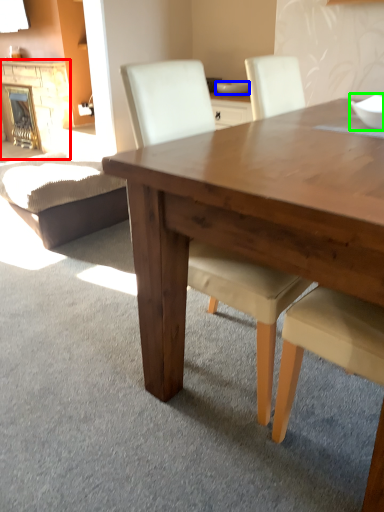
Question: Estimate the real-world distances between objects in this image. Which object is closer to fireplace (highlighted by a red box), bowl (highlighted by a blue box) or bowl (highlighted by a green box)?

Choices:
 (A) bowl
 (B) bowl

Answer: (A)